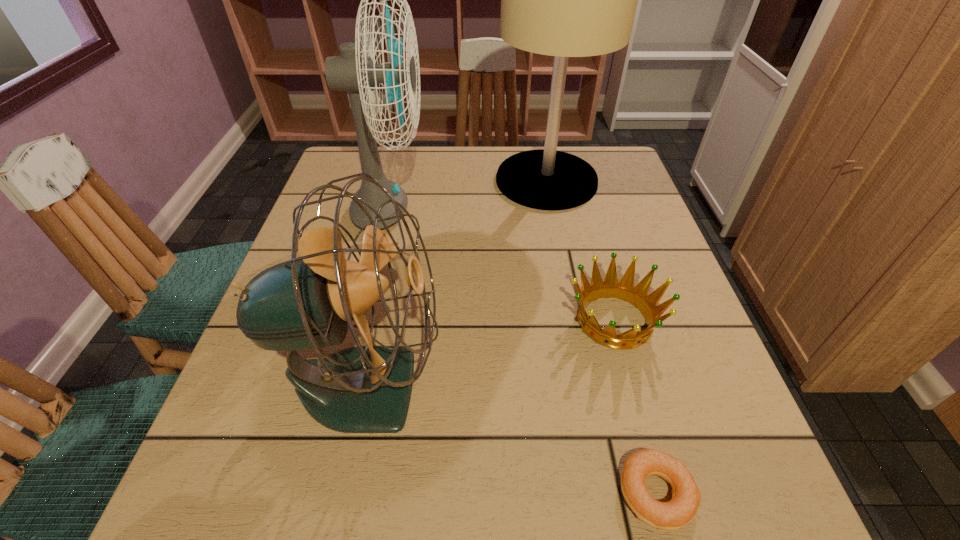
The image size is (960, 540). Find the location of `table lamp`. table lamp is located at coordinates (565, 0).

Identify the location of the taller fan. (356, 73).

Where is `the third tallest object`? the third tallest object is located at coordinates (308, 302).

Where is `the nearer fan`? The width and height of the screenshot is (960, 540). the nearer fan is located at coordinates (308, 302).

Where is `the fourth tallest object`? The height and width of the screenshot is (540, 960). the fourth tallest object is located at coordinates (638, 296).

I want to click on bagel, so click(x=682, y=508).

Where is `vacant space situated 0.130m on the front of the table lamp`? vacant space situated 0.130m on the front of the table lamp is located at coordinates (559, 246).

At what (x,y) coordinates should I click in order to perform the action: click on free space located 0.380m on the front-facing side of the taller fan. Please return your answer as a coordinate pair (x, y). Looking at the image, I should click on (585, 213).

Locate an element on the screen. vacant area situated on the front-facing side of the shorter fan for air flow is located at coordinates (535, 386).

In order to click on vacant region located 0.260m on the back of the crown in this screenshot , I will do `click(584, 208)`.